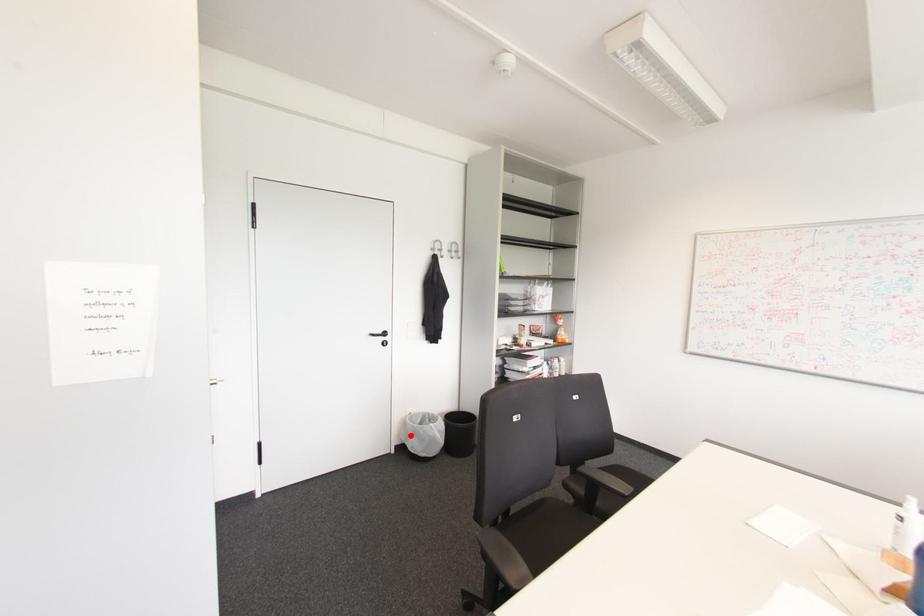
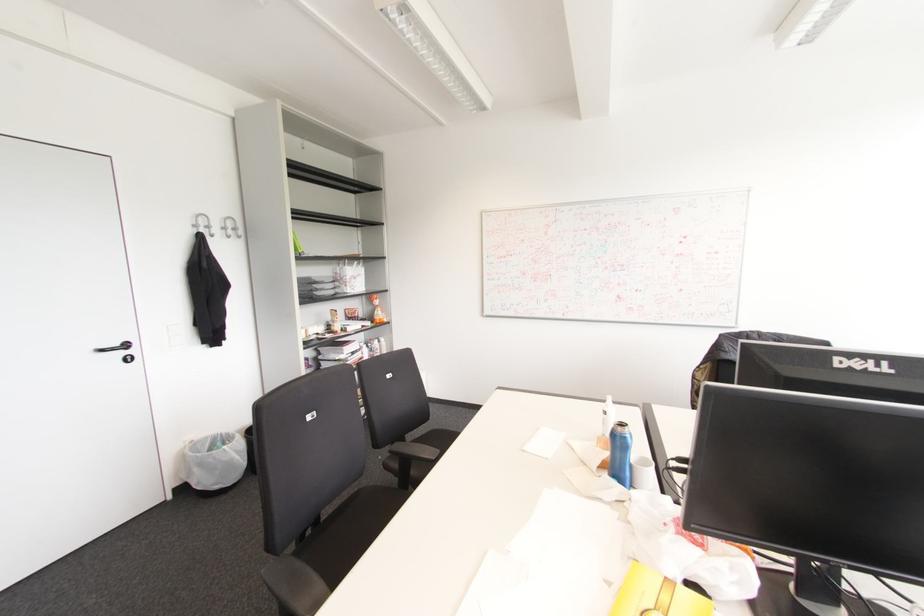
Question: I am providing you with two images of the same scene from different viewpoints. In image1, a red point is highlighted. Considering the same 3D point in image2, which of the following is correct?

Choices:
 (A) It is closer
 (B) It is farther

Answer: (A)